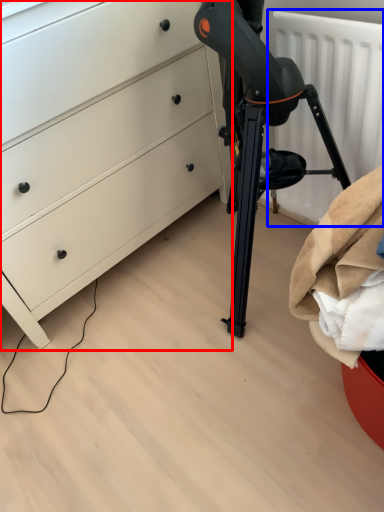
Question: Which point is further to the camera, chest of drawers (highlighted by a red box) or radiator (highlighted by a blue box)?

Choices:
 (A) chest of drawers
 (B) radiator

Answer: (B)